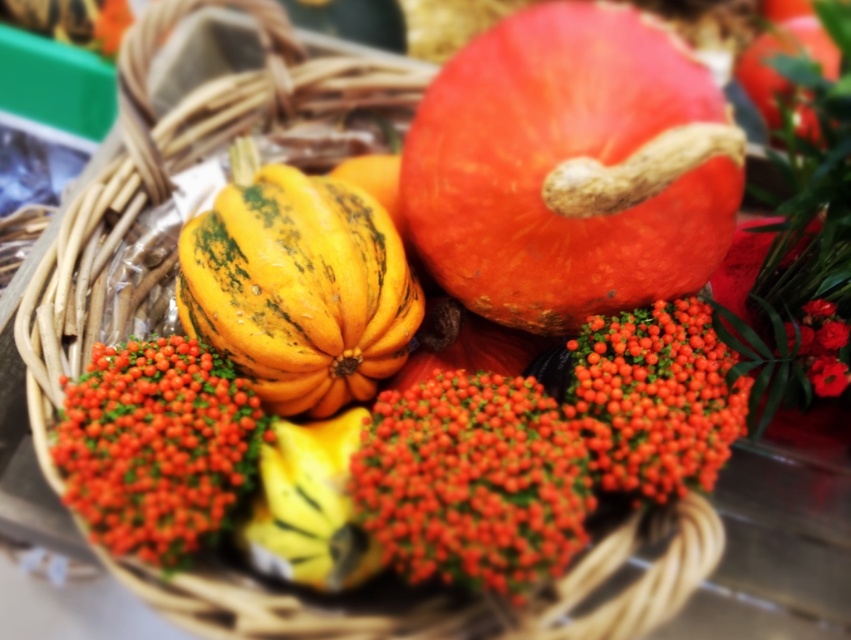
From the picture: You are looking at the autumnal arrangement in the image. Where is the orange matte pumpkin at upper center located in terms of coordinates?

The orange matte pumpkin at upper center is located at coordinates point (570, 168).

You are arranging a fall centerpiece and need to place the orange matte pumpkin at upper center and the shiny orange berries at center. Based on the scene, which object is closer to you?

The orange matte pumpkin at upper center is closer to you as it is in front of the shiny orange berries at center.

You are arranging flowers in a basket and notice the orange matte pumpkin at upper center and the smooth red flower at upper right. Which object is closer to you in the arrangement?

The orange matte pumpkin at upper center is closer to you because it is in front of the smooth red flower at upper right.